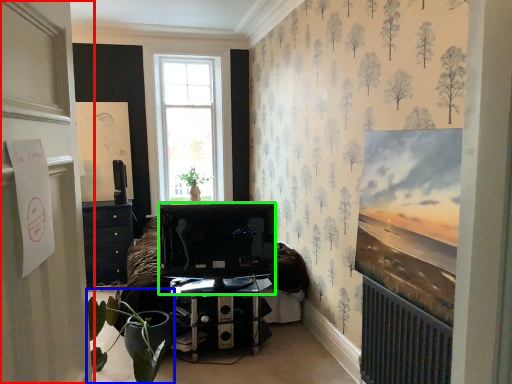
Question: Considering the real-world distances, which object is farthest from door (highlighted by a red box)? houseplant (highlighted by a blue box) or television (highlighted by a green box)?

Choices:
 (A) houseplant
 (B) television

Answer: (B)